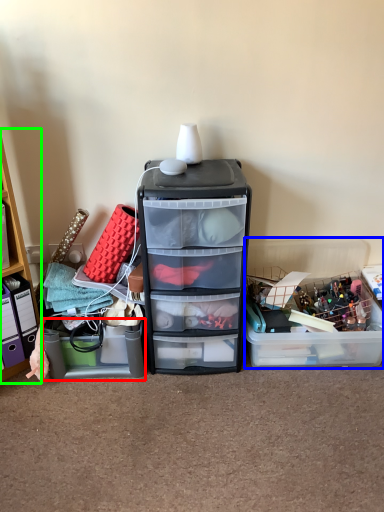
Question: Which object is the closest to the storage box (highlighted by a red box)? Choose among these: storage box (highlighted by a blue box) or cabinetry (highlighted by a green box).

Choices:
 (A) storage box
 (B) cabinetry

Answer: (B)